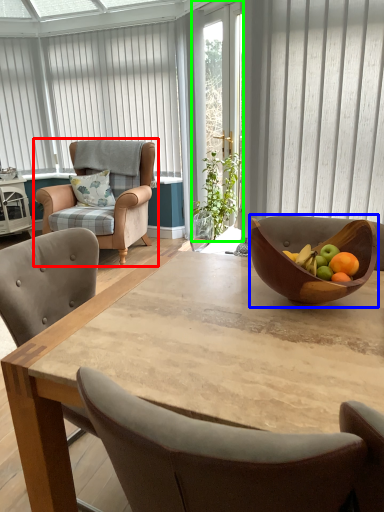
Question: Considering the real-world distances, which object is farthest from chair (highlighted by a red box)? bowl (highlighted by a blue box) or screen door (highlighted by a green box)?

Choices:
 (A) bowl
 (B) screen door

Answer: (A)